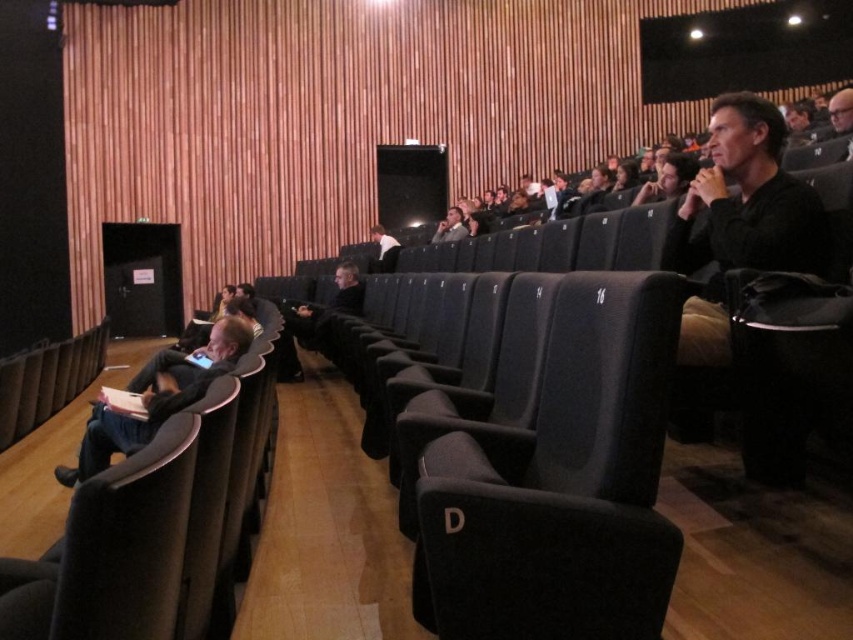
Question: Which is farther from the dark gray fabric jacket at left?

Choices:
 (A) black matte jacket at upper right
 (B) dark gray fabric seat at center

Answer: (A)

Question: Which point is farther from the camera taking this photo?

Choices:
 (A) (647, 296)
 (B) (807, 268)
 (C) (173, 364)

Answer: (C)

Question: Observing the image, what is the correct spatial positioning of dark gray fabric seat at center in reference to dark gray fabric jacket at left?

Choices:
 (A) below
 (B) above

Answer: (B)

Question: Estimate the real-world distances between objects in this image. Which object is closer to the dark gray fabric seat at center?

Choices:
 (A) dark gray fabric jacket at left
 (B) black matte jacket at upper right

Answer: (B)

Question: Considering the relative positions of black matte jacket at upper right and dark gray fabric jacket at left in the image provided, where is black matte jacket at upper right located with respect to dark gray fabric jacket at left?

Choices:
 (A) right
 (B) left

Answer: (A)

Question: Can you confirm if dark gray fabric seat at center is thinner than dark gray fabric jacket at left?

Choices:
 (A) yes
 (B) no

Answer: (A)